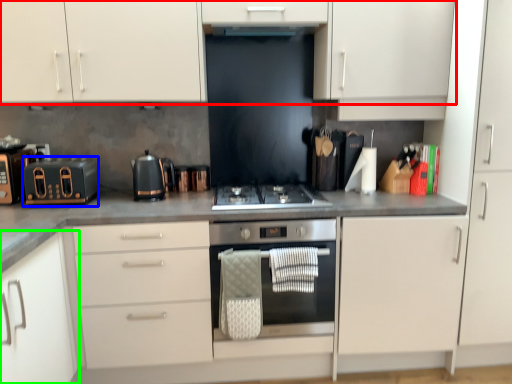
Question: Considering the real-world distances, which object is closest to cabinetry (highlighted by a red box)? kitchen appliance (highlighted by a blue box) or cabinetry (highlighted by a green box).

Choices:
 (A) kitchen appliance
 (B) cabinetry

Answer: (A)